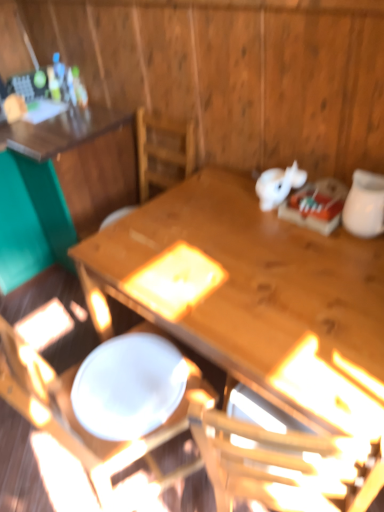
You are a GUI agent. You are given a task and a screenshot of the screen. Output one action in this format:
    pyautogui.click(x=<x>, y=<y>)
    Task: Click on the wooden chair at center
    The width and height of the screenshot is (384, 512).
    Given the screenshot: What is the action you would take?
    pyautogui.click(x=165, y=473)

Looking at this image, in order to face white glossy plate at center, should I rotate leftwards or rightwards?

Turn left by 8.180 degrees to look at white glossy plate at center.

Find the location of a particular element. white glossy jar at upper right is located at coordinates (365, 205).

In order to click on wooden chair at center in this screenshot , I will do pyautogui.click(x=165, y=473).

Between white glossy jar at upper right and wooden table at upper left, which appears as the 2th table when viewed from the right, which one has less height?

white glossy jar at upper right is shorter.

Are white glossy jar at upper right and wooden table at upper left, which appears as the 2th table when viewed from the right, far apart?

Absolutely, white glossy jar at upper right is distant from wooden table at upper left, which appears as the 2th table when viewed from the right.

I want to click on tableware on the right of wooden table at upper left, the 1th table when ordered from left to right, so click(365, 205).

Considering the positions of objects white glossy jar at upper right and wooden table at upper left, which appears as the 2th table when viewed from the right, in the image provided, who is more to the right, white glossy jar at upper right or wooden table at upper left, which appears as the 2th table when viewed from the right,?

white glossy jar at upper right is more to the right.

Is wooden table at center, which is the 2th table in left-to-right order, shorter than white glossy jar at upper right?

In fact, wooden table at center, which is the 2th table in left-to-right order, may be taller than white glossy jar at upper right.

Considering the relative sizes of wooden table at center, which is the 2th table in left-to-right order, and white glossy jar at upper right in the image provided, is wooden table at center, which is the 2th table in left-to-right order, smaller than white glossy jar at upper right?

Incorrect, wooden table at center, which is the 2th table in left-to-right order, is not smaller in size than white glossy jar at upper right.

Is point (112, 287) positioned before point (379, 196)?

No.

Is wooden table at center, the 1th table positioned from the right, to the left or to the right of white glossy jar at upper right in the image?

In the image, wooden table at center, the 1th table positioned from the right, appears on the left side of white glossy jar at upper right.

Is wooden chair at center smaller than wooden table at upper left, the 1th table when ordered from left to right?

Yes, wooden chair at center is smaller than wooden table at upper left, the 1th table when ordered from left to right.

Locate an element on the screen. Image resolution: width=384 pixels, height=512 pixels. chair that appears above the wooden table at upper left, which appears as the 2th table when viewed from the right (from a real-world perspective) is located at coordinates (165, 473).

Is wooden chair at center placed right next to wooden table at upper left, the 1th table when ordered from left to right?

No, wooden chair at center is not touching wooden table at upper left, the 1th table when ordered from left to right.

Is wooden chair at center closer to camera compared to wooden table at upper left, which appears as the 2th table when viewed from the right?

Yes, it is.

Identify the location of table on the right of wooden table at upper left, which appears as the 2th table when viewed from the right. (255, 294).

Looking at the image, does wooden table at upper left, which appears as the 2th table when viewed from the right, seem bigger or smaller compared to wooden table at center, the 1th table positioned from the right?

In the image, wooden table at upper left, which appears as the 2th table when viewed from the right, appears to be smaller than wooden table at center, the 1th table positioned from the right.

Who is taller, wooden table at upper left, the 1th table when ordered from left to right, or wooden table at center, the 1th table positioned from the right?

wooden table at upper left, the 1th table when ordered from left to right.

Is wooden table at upper left, the 1th table when ordered from left to right, facing away from wooden table at center, the 1th table positioned from the right?

That's not correct — wooden table at upper left, the 1th table when ordered from left to right, is not looking away from wooden table at center, the 1th table positioned from the right.

In the scene shown: Considering the sizes of objects wooden chair at center and wooden table at center, the 1th table positioned from the right, in the image provided, who is wider, wooden chair at center or wooden table at center, the 1th table positioned from the right,?

With larger width is wooden table at center, the 1th table positioned from the right.

In the scene shown: Considering the sizes of objects wooden chair at center and wooden table at center, the 1th table positioned from the right, in the image provided, who is shorter, wooden chair at center or wooden table at center, the 1th table positioned from the right,?

Standing shorter between the two is wooden table at center, the 1th table positioned from the right.

Considering the sizes of objects wooden chair at center and wooden table at center, the 1th table positioned from the right, in the image provided, who is bigger, wooden chair at center or wooden table at center, the 1th table positioned from the right,?

Bigger between the two is wooden table at center, the 1th table positioned from the right.

From the image's perspective, between wooden chair at center and wooden table at center, which is the 2th table in left-to-right order, who is located below?

wooden chair at center is shown below in the image.

Is white glossy plate at center thinner than wooden table at center, which is the 2th table in left-to-right order?

Indeed, white glossy plate at center has a lesser width compared to wooden table at center, which is the 2th table in left-to-right order.

Find the location of a particular element. plate behind the wooden table at center, which is the 2th table in left-to-right order is located at coordinates (129, 386).

Is white glossy plate at center situated inside wooden table at center, the 1th table positioned from the right, or outside?

white glossy plate at center lies outside wooden table at center, the 1th table positioned from the right.

Which object is positioned more to the left, white glossy plate at center or wooden table at center, the 1th table positioned from the right?

white glossy plate at center is more to the left.

Which object is wider, wooden chair at center or white glossy jar at upper right?

Wider between the two is wooden chair at center.

Is point (191, 495) less distant than point (367, 170)?

No, it is behind (367, 170).

Would you consider wooden chair at center to be distant from white glossy jar at upper right?

Yes, wooden chair at center is far from white glossy jar at upper right.

Is wooden chair at center bigger or smaller than white glossy jar at upper right?

Clearly, wooden chair at center is larger in size than white glossy jar at upper right.

Image resolution: width=384 pixels, height=512 pixels. I want to click on the 1st table directly beneath the white glossy jar at upper right (from a real-world perspective), so click(75, 170).

This screenshot has width=384, height=512. What are the coordinates of `the 1st table to the left when counting from the white glossy jar at upper right` in the screenshot? It's located at (255, 294).

Looking at the image, which one is located closer to wooden table at upper left, which appears as the 2th table when viewed from the right, white glossy jar at upper right or wooden table at center, the 1th table positioned from the right?

wooden table at center, the 1th table positioned from the right, lies closer to wooden table at upper left, which appears as the 2th table when viewed from the right, than the other object.

When comparing their distances from wooden table at upper left, the 1th table when ordered from left to right, does white glossy plate at center or white glossy jar at upper right seem closer?

white glossy plate at center.

When comparing their distances from wooden table at upper left, which appears as the 2th table when viewed from the right, does wooden table at center, the 1th table positioned from the right, or white glossy jar at upper right seem further?

The object further to wooden table at upper left, which appears as the 2th table when viewed from the right, is white glossy jar at upper right.

Considering their positions, is wooden chair at center positioned closer to white glossy jar at upper right than wooden table at upper left, the 1th table when ordered from left to right?

The object closer to white glossy jar at upper right is wooden chair at center.

Based on their spatial positions, is wooden chair at center or wooden table at center, which is the 2th table in left-to-right order, further from white glossy plate at center?

wooden table at center, which is the 2th table in left-to-right order, lies further to white glossy plate at center than the other object.

Considering their positions, is white glossy plate at center positioned further to wooden table at center, the 1th table positioned from the right, than wooden table at upper left, the 1th table when ordered from left to right?

Among the two, wooden table at upper left, the 1th table when ordered from left to right, is located further to wooden table at center, the 1th table positioned from the right.

Looking at this image, estimate the real-world distances between objects in this image. Which object is further from white glossy jar at upper right, wooden chair at center or white glossy plate at center?

wooden chair at center is positioned further to the anchor white glossy jar at upper right.

Which object lies further to the anchor point wooden table at center, which is the 2th table in left-to-right order, white glossy plate at center or white glossy jar at upper right?

white glossy jar at upper right is positioned further to the anchor wooden table at center, which is the 2th table in left-to-right order.

Where is `table between white glossy plate at center and white glossy jar at upper right`? The image size is (384, 512). table between white glossy plate at center and white glossy jar at upper right is located at coordinates (255, 294).

Locate an element on the screen. The width and height of the screenshot is (384, 512). plate between wooden chair at center and wooden table at upper left, which appears as the 2th table when viewed from the right, in the front-back direction is located at coordinates (129, 386).

The width and height of the screenshot is (384, 512). Identify the location of chair located between wooden table at upper left, the 1th table when ordered from left to right, and white glossy jar at upper right in the left-right direction. click(x=165, y=473).

What are the coordinates of `plate between wooden table at upper left, the 1th table when ordered from left to right, and white glossy jar at upper right, in the horizontal direction` in the screenshot? It's located at (129, 386).